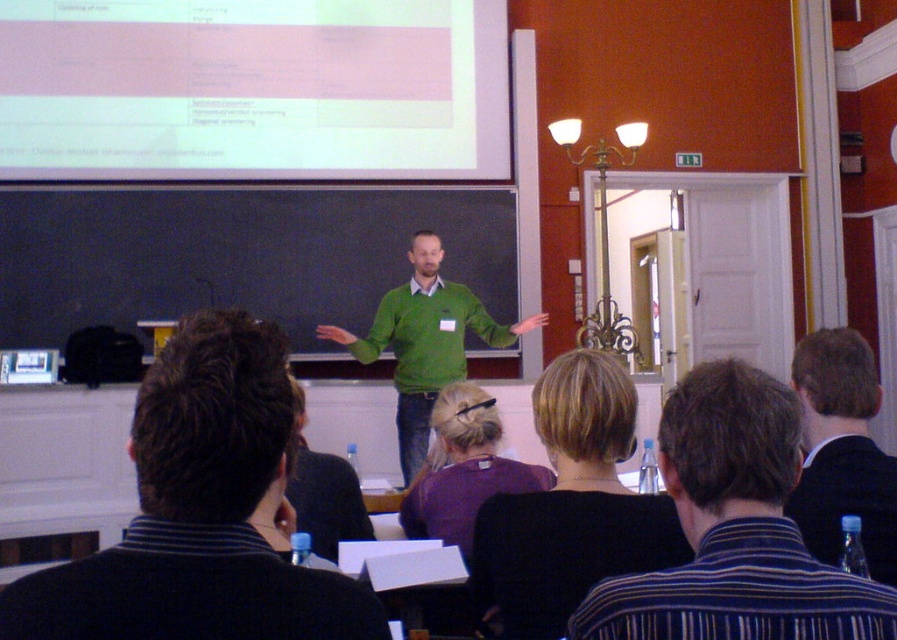
You are a student sitting in the classroom and want to see both the dark green sweater at center and the dark suit jacket at right. Which one is lower in the image?

A: The dark green sweater at center is below dark suit jacket at right, so the dark green sweater at center is lower in the image.

You are a student sitting in the classroom and want to locate the presenter. Where is the dark green sweater at center located in the room?

The dark green sweater at center is located at point 0.802 on the x axis and 0.224 on the y axis.

You are a photographer standing in the classroom and want to take a closeup photo of the striped cotton shirt at lower right. Can you reach it with your camera without moving your position?

The striped cotton shirt at lower right is 1.01 meters from viewer, so yes, the photographer can reach it with their camera since the distance is within a typical camera lens range.